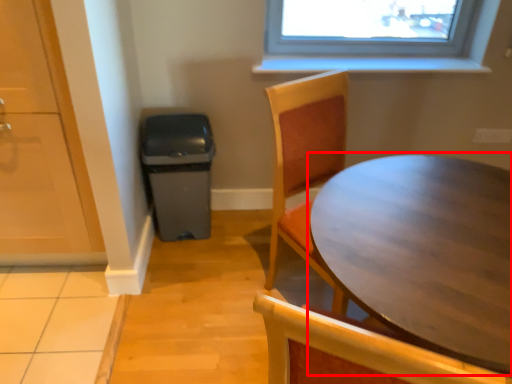
Question: Observing the image, what is the correct spatial positioning of table (annotated by the red box) in reference to screen door?

Choices:
 (A) right
 (B) left

Answer: (A)